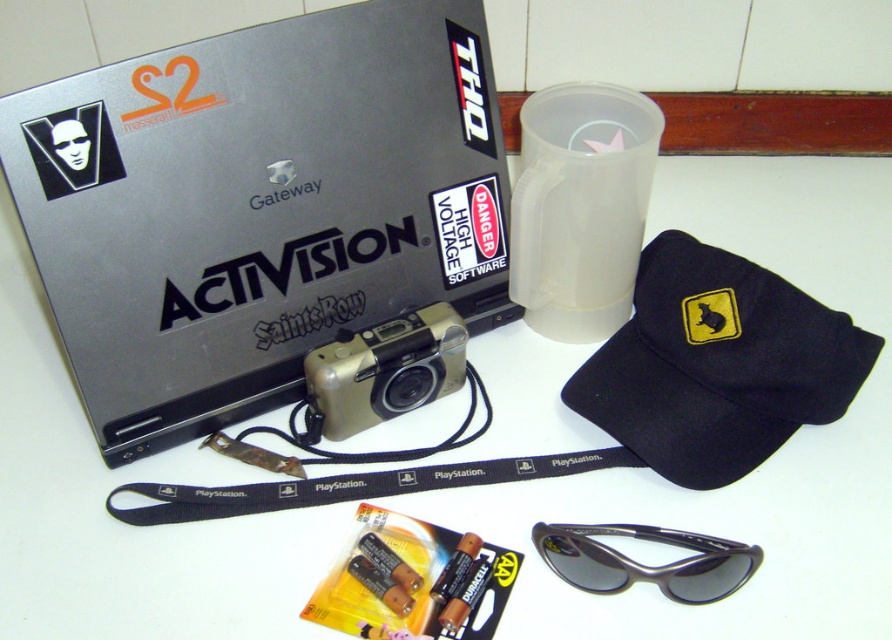
Does silver/black plastic laptop at upper left appear under black fabric lanyard at center?

No.

The height and width of the screenshot is (640, 892). Identify the location of silver/black plastic laptop at upper left. (258, 205).

Where is `silver/black plastic laptop at upper left`? The image size is (892, 640). silver/black plastic laptop at upper left is located at coordinates (258, 205).

In the scene shown: Can you confirm if black fabric baseball cap at center-right is wider than black fabric lanyard at center?

In fact, black fabric baseball cap at center-right might be narrower than black fabric lanyard at center.

Describe the element at coordinates (717, 364) in the screenshot. This screenshot has height=640, width=892. I see `black fabric baseball cap at center-right` at that location.

Image resolution: width=892 pixels, height=640 pixels. In order to click on black fabric baseball cap at center-right in this screenshot , I will do `click(717, 364)`.

The width and height of the screenshot is (892, 640). Identify the location of black fabric baseball cap at center-right. (x=717, y=364).

Does point (666, 372) lie behind point (389, 340)?

Yes, point (666, 372) is farther from viewer.

Where is `black fabric baseball cap at center-right`? Image resolution: width=892 pixels, height=640 pixels. black fabric baseball cap at center-right is located at coordinates (717, 364).